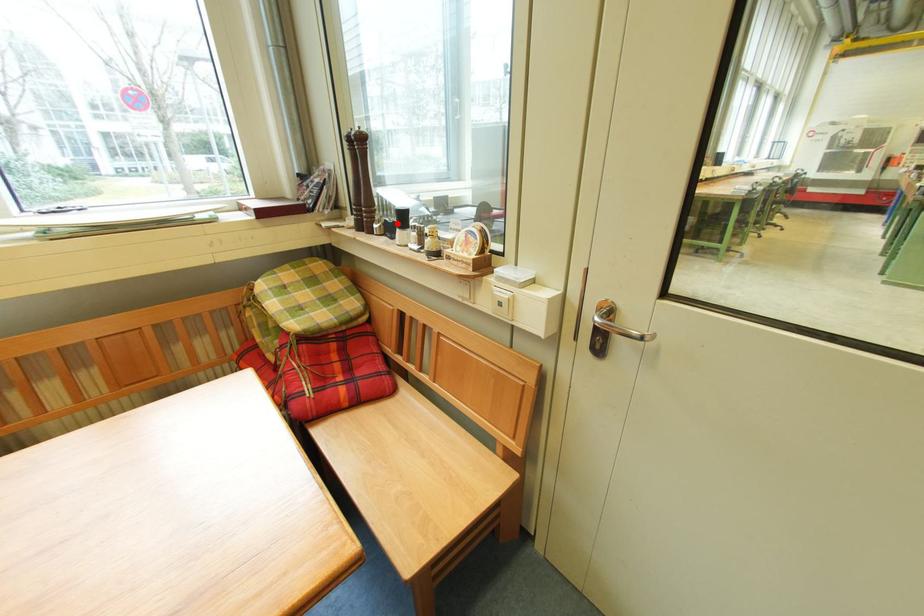
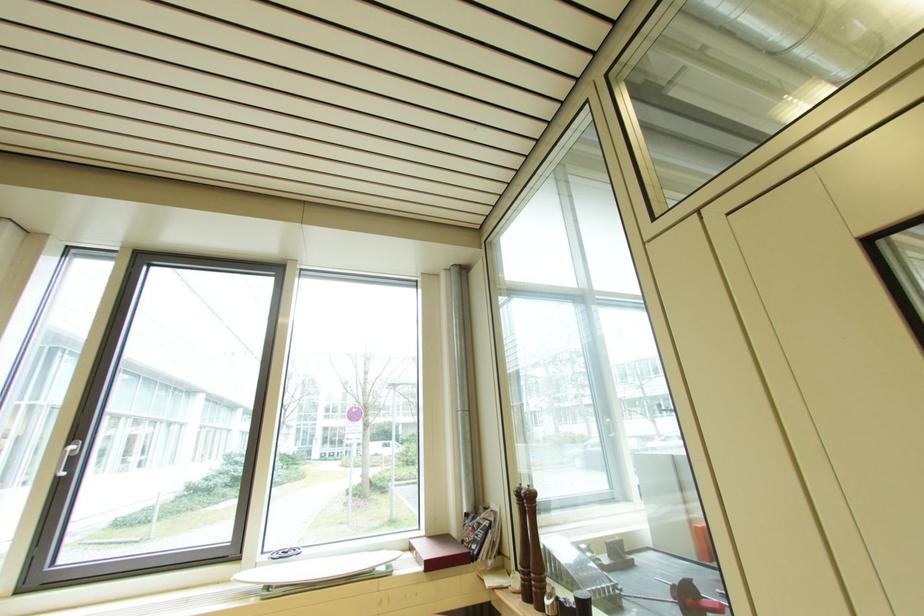
Locate, in the second image, the point that corresponds to the highlighted location in the first image.

(574, 605)